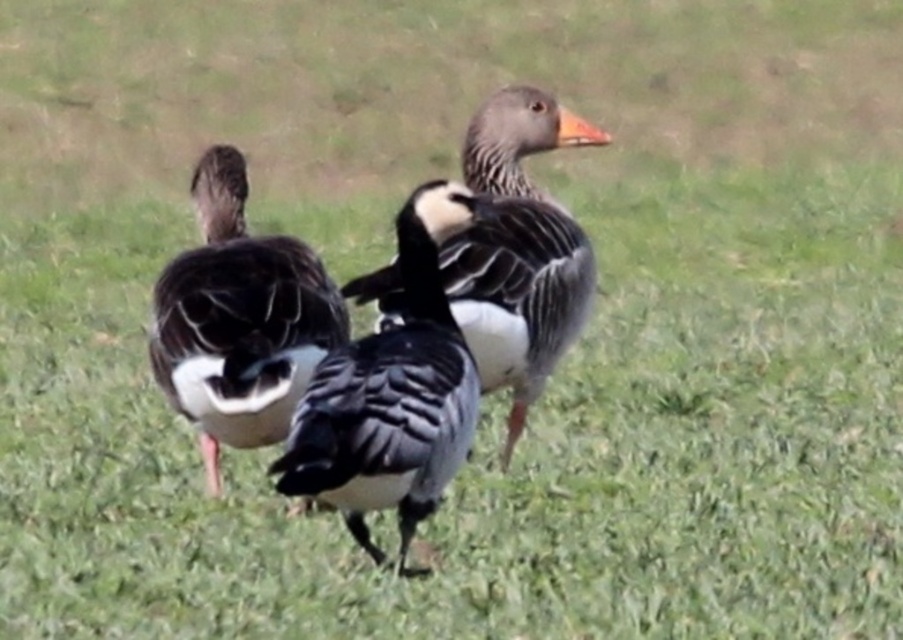
Who is lower down, dark gray feathers at center or gray matte goose at center?

Positioned lower is dark gray feathers at center.

Between dark gray feathers at center and gray matte goose at center, which one has more height?

gray matte goose at center

Based on the photo, measure the distance between dark gray feathers at center and camera.

The distance of dark gray feathers at center from camera is 2.79 meters.

I want to click on dark gray feathers at center, so click(x=239, y=320).

Measure the distance from black glossy duck at center to dark gray feathers at center.

The distance of black glossy duck at center from dark gray feathers at center is 14.39 inches.

Who is positioned more to the right, black glossy duck at center or dark gray feathers at center?

black glossy duck at center is more to the right.

Is point (352, 413) farther from camera compared to point (261, 241)?

No, (352, 413) is in front of (261, 241).

You are a GUI agent. You are given a task and a screenshot of the screen. Output one action in this format:
    pyautogui.click(x=<x>, y=<y>)
    Task: Click on the black glossy duck at center
    This screenshot has width=903, height=640.
    Given the screenshot: What is the action you would take?
    pyautogui.click(x=392, y=394)

Between black glossy duck at center and gray matte goose at center, which one is positioned higher?

gray matte goose at center

How distant is black glossy duck at center from gray matte goose at center?

The distance of black glossy duck at center from gray matte goose at center is 16.07 inches.

Is point (431, 496) more distant than point (520, 269)?

That is False.

This screenshot has width=903, height=640. What are the coordinates of `black glossy duck at center` in the screenshot? It's located at (392, 394).